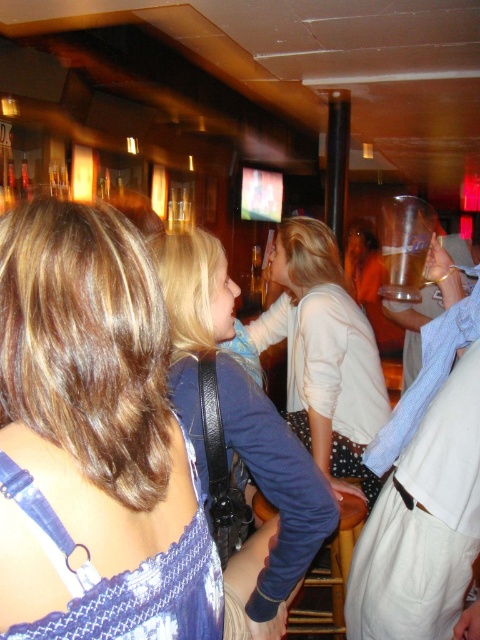
Question: Can you confirm if blue fabric dress at upper left is positioned to the left of white textured sweater at center?

Choices:
 (A) yes
 (B) no

Answer: (A)

Question: Is the position of blue denim shirt at center less distant than that of white textured sweater at center?

Choices:
 (A) yes
 (B) no

Answer: (A)

Question: Is white textured sweater at center to the left of clear plastic cup at center from the viewer's perspective?

Choices:
 (A) no
 (B) yes

Answer: (B)

Question: Which point is farther from the camera taking this photo?

Choices:
 (A) (286, 548)
 (B) (404, 269)
 (C) (479, 230)
 (D) (44, 428)

Answer: (C)

Question: Which point appears closest to the camera in this image?

Choices:
 (A) (349, 372)
 (B) (408, 378)

Answer: (A)

Question: Which object appears closest to the camera in this image?

Choices:
 (A) clear plastic cup at upper right
 (B) blue denim shirt at center
 (C) clear plastic cup at center
 (D) blue fabric dress at upper left

Answer: (D)